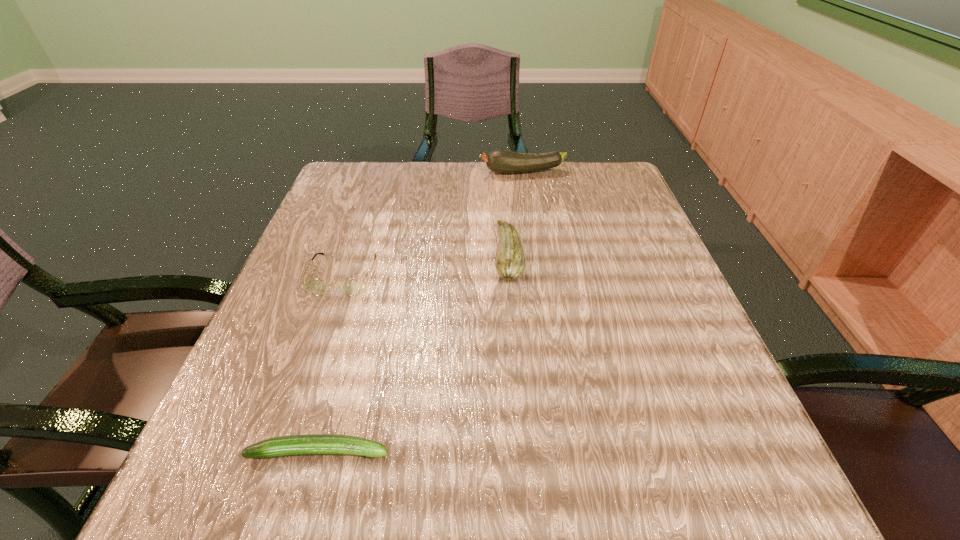
Identify the location of the farthest object. (500, 161).

The height and width of the screenshot is (540, 960). What are the coordinates of `the second farthest zucchini` in the screenshot? It's located at (510, 263).

You are a GUI agent. You are given a task and a screenshot of the screen. Output one action in this format:
    pyautogui.click(x=<x>, y=<y>)
    Task: Click on the third tallest object
    Image resolution: width=960 pixels, height=540 pixels.
    Given the screenshot: What is the action you would take?
    pyautogui.click(x=351, y=287)

This screenshot has height=540, width=960. What are the coordinates of `the leftmost zucchini` in the screenshot? It's located at (312, 444).

Identify the location of the nearest object. (312, 444).

You are a GUI agent. You are given a task and a screenshot of the screen. Output one action in this format:
    pyautogui.click(x=<x>, y=<y>)
    Task: Click on the free region located 0.360m at the blossom end of the farthest object
    
    Given the screenshot: What is the action you would take?
    pyautogui.click(x=340, y=172)

You are a GUI agent. You are given a task and a screenshot of the screen. Output one action in this format:
    pyautogui.click(x=<x>, y=<y>)
    Task: Click on the free location located 0.140m at the blossom end of the farthest object
    
    Given the screenshot: What is the action you would take?
    425,172

Locate an element on the screen. This screenshot has height=540, width=960. vacant space located 0.230m at the blossom end of the farthest object is located at coordinates (391, 172).

Where is `free space located at the stem end of the second nearest zucchini`? The height and width of the screenshot is (540, 960). free space located at the stem end of the second nearest zucchini is located at coordinates (341, 255).

Find the location of a particular element. vacant space located at the stem end of the second nearest zucchini is located at coordinates (331, 255).